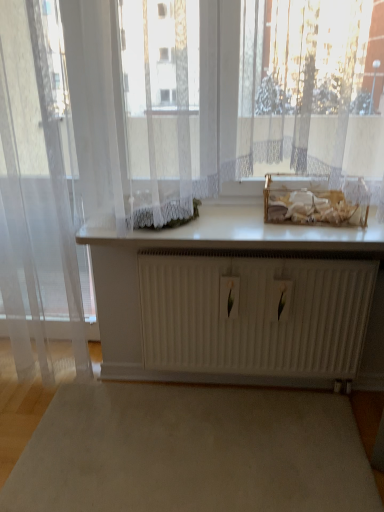
Question: Relative to white glossy counter top at center, is beige carpet at center in front or behind?

Choices:
 (A) behind
 (B) front

Answer: (B)

Question: Is beige carpet at center situated inside white glossy counter top at center or outside?

Choices:
 (A) outside
 (B) inside

Answer: (A)

Question: Estimate the real-world distances between objects in this image. Which object is closer to the transparent fabric curtain at left?

Choices:
 (A) white glossy counter top at center
 (B) beige carpet at center
 (C) white matte radiator at center

Answer: (A)

Question: Which object is the closest to the white glossy counter top at center?

Choices:
 (A) beige carpet at center
 (B) transparent fabric curtain at left
 (C) white matte radiator at center

Answer: (C)